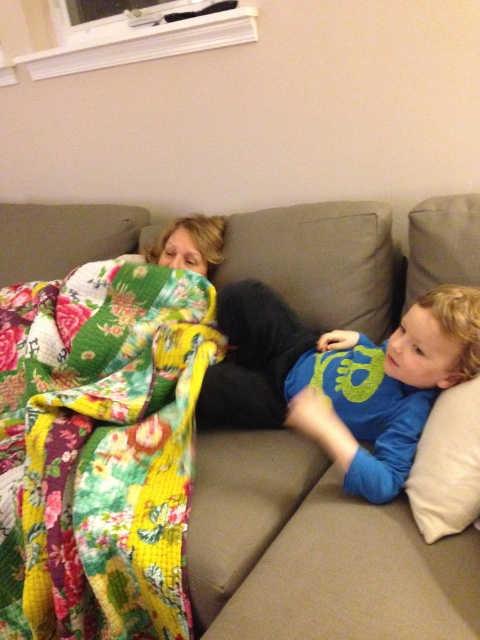
Is floral patchwork quilt at left closer to the viewer compared to white soft pillow at right?

No.

Who is higher up, floral patchwork quilt at left or white soft pillow at right?

floral patchwork quilt at left is higher up.

Does point (94, 525) come farther from viewer compared to point (411, 492)?

Yes.

You are a GUI agent. You are given a task and a screenshot of the screen. Output one action in this format:
    pyautogui.click(x=<x>, y=<y>)
    Task: Click on the floral patchwork quilt at left
    
    Given the screenshot: What is the action you would take?
    pyautogui.click(x=99, y=449)

Describe the element at coordinates (100, 445) in the screenshot. Image resolution: width=480 pixels, height=640 pixels. I see `soft gray couch at center` at that location.

Is soft gray couch at center shorter than white soft pillow at right?

No.

This screenshot has height=640, width=480. Find the location of `soft gray couch at center`. soft gray couch at center is located at coordinates (100, 445).

Is point (87, 580) farther from camera compared to point (239, 352)?

No, it is not.

Can you confirm if floral patchwork quilt at left is positioned below blue cotton shirt at right?

Indeed, floral patchwork quilt at left is positioned under blue cotton shirt at right.

Between point (145, 548) and point (359, 346), which one is positioned behind?

Point (359, 346)

The image size is (480, 640). I want to click on floral patchwork quilt at left, so click(x=99, y=449).